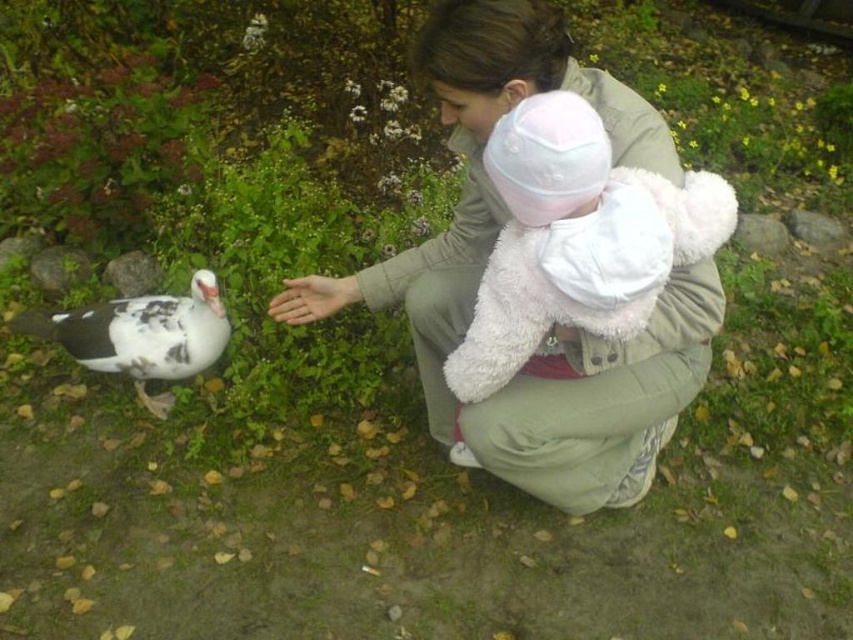
You are standing in the garden and want to hand a small treat to the child wearing the white plush hat at upper center. Given that you can reach out 1.3 meters, can you reach them?

The distance between you and the white plush hat at upper center is 1.40 meters, which is slightly beyond your 1.3 meter reach. You cannot reach them directly.

You are a photographer trying to capture a closeup of the white speckled feather at lower left while also including the light beige fleece jacket at center in the frame. Based on their positions, which object should you focus on first to ensure both are in the shot?

A: Since the light beige fleece jacket at center is to the right of the white speckled feather at lower left, you should focus on the white speckled feather at lower left first to ensure both are in the frame.